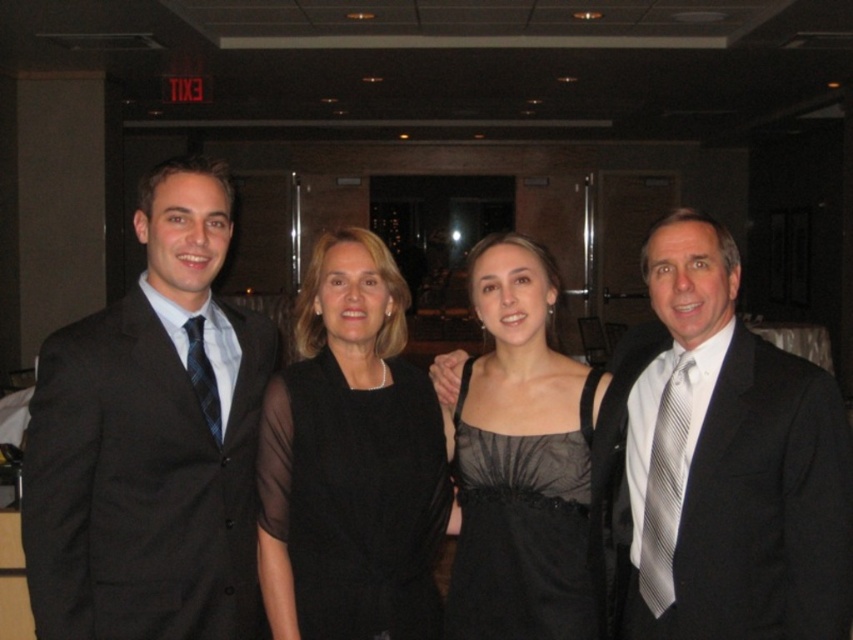
Question: Among these objects, which one is nearest to the camera?

Choices:
 (A) gray striped tie at right
 (B) blue striped tie at left

Answer: (B)

Question: Is the position of matte black suit at left more distant than that of black satin dress at center?

Choices:
 (A) yes
 (B) no

Answer: (B)

Question: Which object is positioned closest to the matte black suit at left?

Choices:
 (A) gray striped tie at right
 (B) black satin dress at center

Answer: (B)

Question: Considering the real-world distances, which object is closest to the matte black suit at right?

Choices:
 (A) blue striped tie at left
 (B) black silk suit at right
 (C) gray striped tie at right
 (D) black satin dress at center

Answer: (B)

Question: Considering the relative positions of black sheer dress at center and black satin dress at center in the image provided, where is black sheer dress at center located with respect to black satin dress at center?

Choices:
 (A) left
 (B) right

Answer: (A)

Question: Where is matte black suit at right located in relation to blue striped tie at left in the image?

Choices:
 (A) below
 (B) above

Answer: (A)